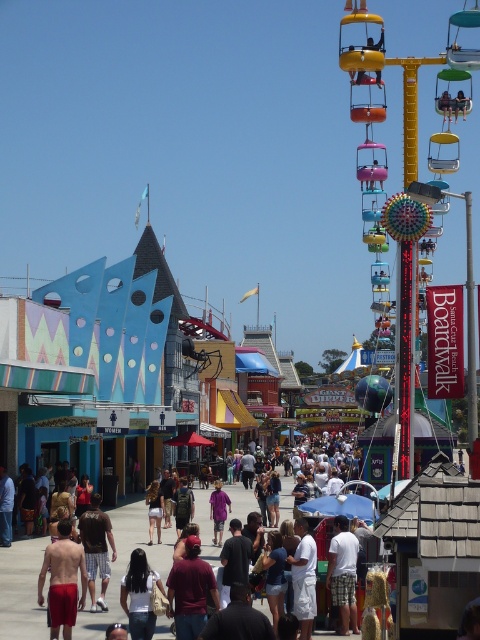
Identify the location of white cotton shirt at center. The image size is (480, 640). (343, 573).

Does white cotton shirt at center have a lesser height compared to brown cotton t-shirt at center?

Indeed, white cotton shirt at center has a lesser height compared to brown cotton t-shirt at center.

Identify the location of white cotton shirt at center. (343, 573).

Is point (72, 556) behind point (84, 536)?

No, it is in front of (84, 536).

Can you confirm if red matte shorts at lower left is positioned to the right of brown cotton t-shirt at center?

Incorrect, red matte shorts at lower left is not on the right side of brown cotton t-shirt at center.

Is point (69, 582) farther from camera compared to point (96, 499)?

No.

You are a GUI agent. You are given a task and a screenshot of the screen. Output one action in this format:
    pyautogui.click(x=<x>, y=<y>)
    Task: Click on the red matte shorts at lower left
    This screenshot has width=480, height=640.
    Given the screenshot: What is the action you would take?
    pyautogui.click(x=62, y=580)

Can you confirm if red matte shorts at lower left is smaller than white cotton shirt at center?

Incorrect, red matte shorts at lower left is not smaller in size than white cotton shirt at center.

Describe the element at coordinates (62, 580) in the screenshot. The height and width of the screenshot is (640, 480). I see `red matte shorts at lower left` at that location.

Who is more forward, (72, 598) or (331, 552)?

Positioned in front is point (72, 598).

You are a GUI agent. You are given a task and a screenshot of the screen. Output one action in this format:
    pyautogui.click(x=<x>, y=<y>)
    Task: Click on the red matte shorts at lower left
    
    Given the screenshot: What is the action you would take?
    pyautogui.click(x=62, y=580)